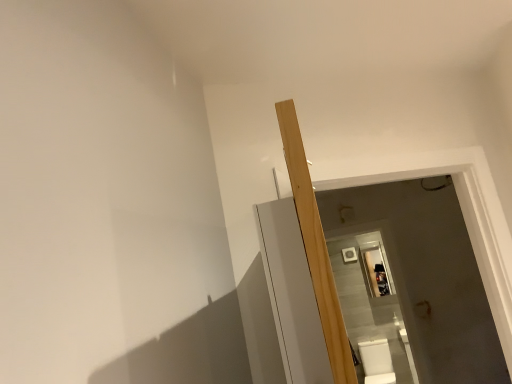
Question: Is point (339, 311) positioned closer to the camera than point (370, 377)?

Choices:
 (A) closer
 (B) farther

Answer: (A)

Question: Considering the positions of light wood beam at center and white glossy toilet bowl at lower right in the image, is light wood beam at center taller or shorter than white glossy toilet bowl at lower right?

Choices:
 (A) tall
 (B) short

Answer: (A)

Question: Based on their positions, is light wood beam at center located to the left or right of white glossy toilet bowl at lower right?

Choices:
 (A) left
 (B) right

Answer: (A)

Question: Considering the positions of white glossy toilet bowl at lower right and light wood beam at center in the image, is white glossy toilet bowl at lower right taller or shorter than light wood beam at center?

Choices:
 (A) short
 (B) tall

Answer: (A)

Question: Is white glossy toilet bowl at lower right situated inside light wood beam at center or outside?

Choices:
 (A) inside
 (B) outside

Answer: (B)

Question: Is point (387, 365) positioned closer to the camera than point (289, 168)?

Choices:
 (A) closer
 (B) farther

Answer: (B)

Question: Relative to light wood beam at center, is white glossy toilet bowl at lower right in front or behind?

Choices:
 (A) behind
 (B) front

Answer: (A)